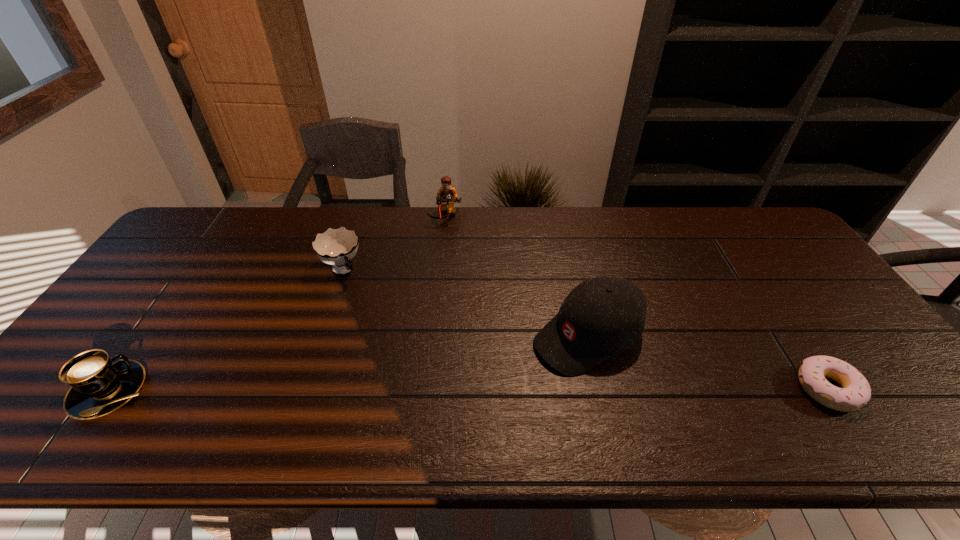
You are a GUI agent. You are given a task and a screenshot of the screen. Output one action in this format:
    pyautogui.click(x=<x>, y=<y>)
    Task: Click on the vacant space on the desktop that is between the leftmost object and the rightmost object and is positioned holding a crossbow in the hands of the farthest object
    This screenshot has width=960, height=540.
    Given the screenshot: What is the action you would take?
    pyautogui.click(x=477, y=390)

Identify the location of free spot on the desktop that is between the cappuccino and the rightmost object and is positioned on the side of the fourth nearest object with the handle. (438, 390).

You are a GUI agent. You are given a task and a screenshot of the screen. Output one action in this format:
    pyautogui.click(x=<x>, y=<y>)
    Task: Click on the vacant spot on the desktop that is between the cappuccino and the shortest object and is positioned with a logo on the front of the baseball cap
    
    Given the screenshot: What is the action you would take?
    pyautogui.click(x=492, y=390)